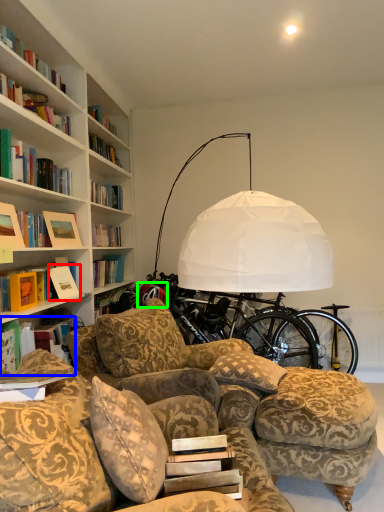
Question: Estimate the real-world distances between objects in this image. Which object is farther from book (highlighted by a red box), book (highlighted by a blue box) or wheel (highlighted by a green box)?

Choices:
 (A) book
 (B) wheel

Answer: (B)